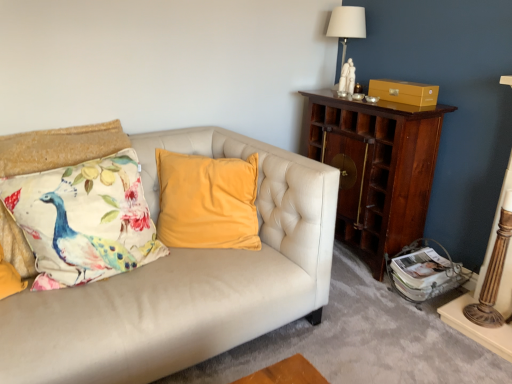
Question: Does printed fabric cushion with peacock design at left have a greater height compared to white ceramic table lamp at upper right?

Choices:
 (A) yes
 (B) no

Answer: (B)

Question: Is printed fabric cushion with peacock design at left bigger than white ceramic table lamp at upper right?

Choices:
 (A) no
 (B) yes

Answer: (B)

Question: Considering the relative sizes of printed fabric cushion with peacock design at left and white ceramic table lamp at upper right in the image provided, is printed fabric cushion with peacock design at left smaller than white ceramic table lamp at upper right?

Choices:
 (A) yes
 (B) no

Answer: (B)

Question: Considering the relative sizes of printed fabric cushion with peacock design at left and white ceramic table lamp at upper right in the image provided, is printed fabric cushion with peacock design at left thinner than white ceramic table lamp at upper right?

Choices:
 (A) no
 (B) yes

Answer: (A)

Question: Can you see printed fabric cushion with peacock design at left touching white ceramic table lamp at upper right?

Choices:
 (A) no
 (B) yes

Answer: (A)

Question: In terms of width, does printed fabric cushion with peacock design at left look wider or thinner when compared to matte gold drawer at upper right?

Choices:
 (A) thin
 (B) wide

Answer: (B)

Question: Would you say printed fabric cushion with peacock design at left is to the left or to the right of matte gold drawer at upper right in the picture?

Choices:
 (A) left
 (B) right

Answer: (A)

Question: Based on their sizes in the image, would you say printed fabric cushion with peacock design at left is bigger or smaller than matte gold drawer at upper right?

Choices:
 (A) big
 (B) small

Answer: (A)

Question: From a real-world perspective, is printed fabric cushion with peacock design at left physically located above or below matte gold drawer at upper right?

Choices:
 (A) below
 (B) above

Answer: (A)

Question: From a real-world perspective, is wooden cabinet at right above or below printed fabric cushion with peacock design at left?

Choices:
 (A) below
 (B) above

Answer: (A)

Question: Is point (419, 196) positioned closer to the camera than point (114, 256)?

Choices:
 (A) farther
 (B) closer

Answer: (A)

Question: Is wooden cabinet at right situated inside printed fabric cushion with peacock design at left or outside?

Choices:
 (A) outside
 (B) inside

Answer: (A)

Question: Is wooden cabinet at right to the left or to the right of printed fabric cushion with peacock design at left in the image?

Choices:
 (A) right
 (B) left

Answer: (A)

Question: Considering the positions of matte gold drawer at upper right and printed fabric cushion with peacock design at left in the image, is matte gold drawer at upper right taller or shorter than printed fabric cushion with peacock design at left?

Choices:
 (A) short
 (B) tall

Answer: (A)

Question: From a real-world perspective, is matte gold drawer at upper right above or below printed fabric cushion with peacock design at left?

Choices:
 (A) above
 (B) below

Answer: (A)